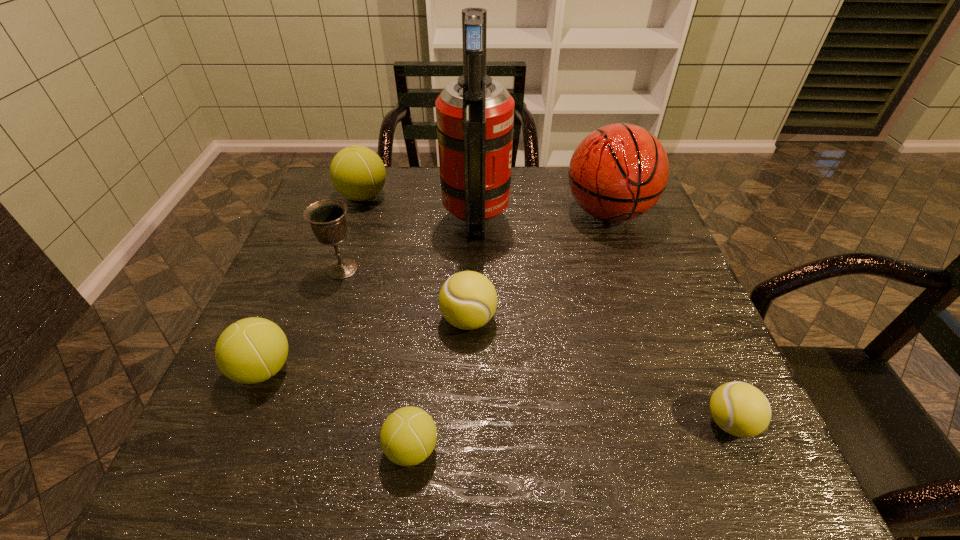
The width and height of the screenshot is (960, 540). What are the coordinates of `green tennis ball that is the closest to the nearest green tennis ball` in the screenshot? It's located at (251, 350).

Locate which green tennis ball is the second closest to the seventh shortest object. Please provide its 2D coordinates. Your answer should be formatted as a tuple, i.e. [(x, y)], where the tuple contains the x and y coordinates of a point satisfying the conditions above.

[(408, 436)]

What are the coordinates of `vacant space that satisfies the following two spatial constraints: 1. on the front label side of the red fire extinguisher; 2. on the front side of the nearest green tennis ball` in the screenshot? It's located at (473, 449).

You are a GUI agent. You are given a task and a screenshot of the screen. Output one action in this format:
    pyautogui.click(x=<x>, y=<y>)
    Task: Click on the free space in the image that satisfies the following two spatial constraints: 1. on the back side of the nearest green tennis ball; 2. on the right side of the nearer yellow tennis ball
    This screenshot has width=960, height=540.
    Given the screenshot: What is the action you would take?
    pyautogui.click(x=415, y=422)

You are a GUI agent. You are given a task and a screenshot of the screen. Output one action in this format:
    pyautogui.click(x=<x>, y=<y>)
    Task: Click on the free spot that satisfies the following two spatial constraints: 1. on the back side of the rightmost tennis ball; 2. on the front label side of the fire extinguisher
    
    Given the screenshot: What is the action you would take?
    pyautogui.click(x=639, y=217)